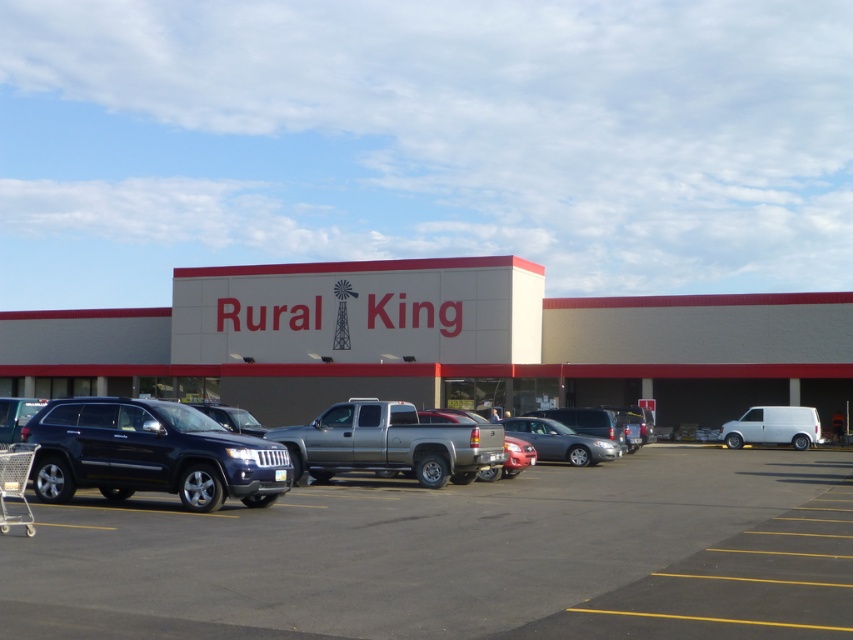
Question: In this image, where is beige concrete building at center located relative to matte black suv at center?

Choices:
 (A) left
 (B) right

Answer: (A)

Question: Does matte black suv at lower left appear on the left side of satin silver suv at center?

Choices:
 (A) no
 (B) yes

Answer: (B)

Question: Among these points, which one is farthest from the camera?

Choices:
 (A) (666, 317)
 (B) (325, 436)

Answer: (A)

Question: Which of these objects is positioned closest to the matte black suv at center?

Choices:
 (A) satin silver sedan at center
 (B) white matte van at right
 (C) metallic silver shopping cart at lower left
 (D) beige concrete building at center

Answer: (A)

Question: Which point is farther to the camera?

Choices:
 (A) (24, 426)
 (B) (538, 435)
 (C) (50, 323)

Answer: (C)

Question: Does matte black suv at center lie behind metallic silver shopping cart at lower left?

Choices:
 (A) yes
 (B) no

Answer: (A)